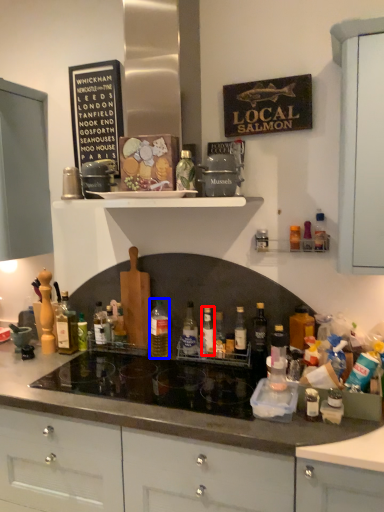
Question: Which point is closer to the camera, bottle (highlighted by a red box) or bottle (highlighted by a blue box)?

Choices:
 (A) bottle
 (B) bottle

Answer: (A)